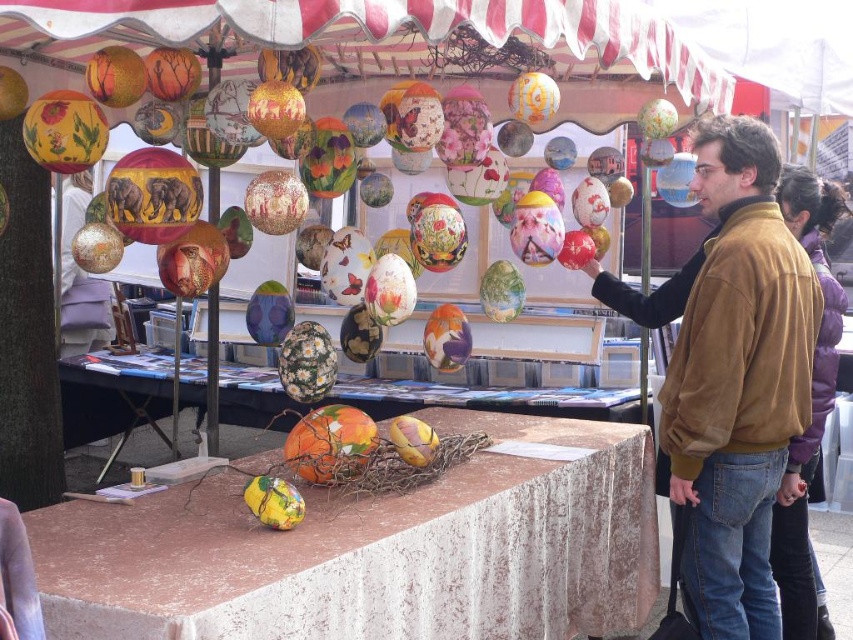
Which is below, velvet-like beige tablecloth at lower center or brown suede jacket at upper right?

Positioned lower is velvet-like beige tablecloth at lower center.

Between velvet-like beige tablecloth at lower center and brown suede jacket at upper right, which one is positioned higher?

brown suede jacket at upper right is higher up.

You are a GUI agent. You are given a task and a screenshot of the screen. Output one action in this format:
    pyautogui.click(x=<x>, y=<y>)
    Task: Click on the velvet-like beige tablecloth at lower center
    
    Given the screenshot: What is the action you would take?
    pyautogui.click(x=375, y=550)

Which is behind, point (379, 516) or point (805, 429)?

Point (805, 429)

Which is more to the right, velvet-like beige tablecloth at lower center or brown leather jacket at right?

brown leather jacket at right

Who is more forward, (604, 529) or (792, 458)?

Point (792, 458) is in front.

Identify the location of velvet-like beige tablecloth at lower center. (375, 550).

Does brown suede jacket at upper right have a larger size compared to marble table at center?

Actually, brown suede jacket at upper right might be smaller than marble table at center.

Is brown suede jacket at upper right closer to camera compared to marble table at center?

Yes, it is in front of marble table at center.

Is point (712, 147) more distant than point (189, 365)?

No, it is in front of (189, 365).

The image size is (853, 640). Identify the location of brown suede jacket at upper right. (732, 376).